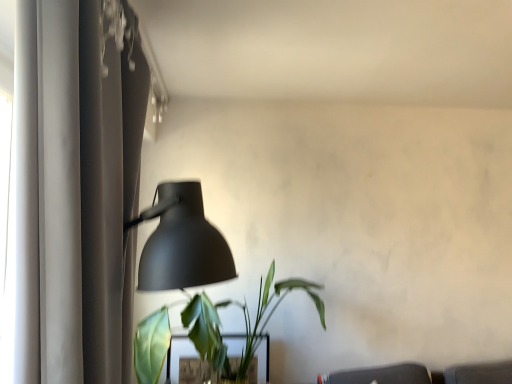
Question: From the image's perspective, is green matte plant at lower center below green matte plant at lower center?

Choices:
 (A) yes
 (B) no

Answer: (A)

Question: Does green matte plant at lower center have a lesser height compared to green matte plant at lower center?

Choices:
 (A) no
 (B) yes

Answer: (B)

Question: Is green matte plant at lower center to the left of green matte plant at lower center from the viewer's perspective?

Choices:
 (A) yes
 (B) no

Answer: (A)

Question: Can you confirm if green matte plant at lower center is wider than green matte plant at lower center?

Choices:
 (A) no
 (B) yes

Answer: (A)

Question: Does green matte plant at lower center have a smaller size compared to green matte plant at lower center?

Choices:
 (A) yes
 (B) no

Answer: (A)

Question: Is green matte plant at lower center spatially inside matte gray curtain at left, or outside of it?

Choices:
 (A) inside
 (B) outside

Answer: (B)

Question: In the image, is green matte plant at lower center on the left side or the right side of matte gray curtain at left?

Choices:
 (A) right
 (B) left

Answer: (A)

Question: Is point (237, 344) positioned closer to the camera than point (74, 248)?

Choices:
 (A) farther
 (B) closer

Answer: (A)

Question: From the image's perspective, relative to matte gray curtain at left, is green matte plant at lower center above or below?

Choices:
 (A) above
 (B) below

Answer: (B)

Question: Does point click(x=158, y=342) appear closer or farther from the camera than point click(x=185, y=240)?

Choices:
 (A) farther
 (B) closer

Answer: (A)

Question: From the image's perspective, is green matte plant at lower center located above or below matte black lamp at left?

Choices:
 (A) above
 (B) below

Answer: (B)

Question: Is green matte plant at lower center bigger or smaller than matte black lamp at left?

Choices:
 (A) small
 (B) big

Answer: (B)

Question: From a real-world perspective, is green matte plant at lower center physically located above or below matte black lamp at left?

Choices:
 (A) above
 (B) below

Answer: (B)

Question: Is matte gray curtain at left to the left or to the right of matte black lamp at left in the image?

Choices:
 (A) left
 (B) right

Answer: (A)

Question: In terms of height, does matte gray curtain at left look taller or shorter compared to matte black lamp at left?

Choices:
 (A) tall
 (B) short

Answer: (A)